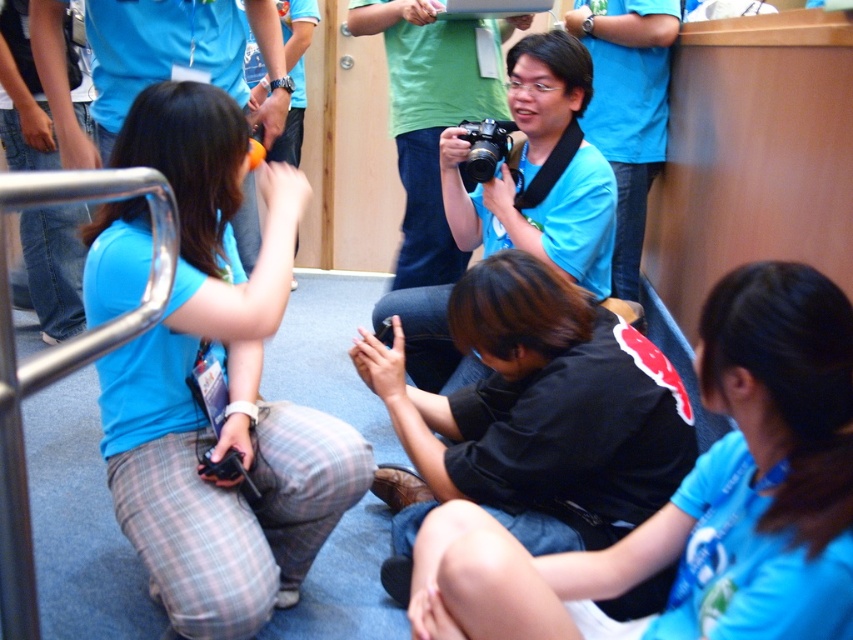
You are organizing a photo shoot and need to ensure that the matte blue shirt at left and the black plastic camera at center are both visible in the frame. Given their sizes, which object should be placed closer to the camera to maintain visibility?

The matte blue shirt at left is larger than the black plastic camera at center. To ensure both are visible, the black plastic camera at center should be placed closer to the camera so its smaller size can be captured clearly alongside the larger matte blue shirt at left.

In the scene described, there is a point located at coordinates (225, 388). Which object from the list is this point situated on?

The point at (225, 388) is situated on the matte blue shirt at left.

Looking at this image, you are standing in the room and see the point marked as point (540, 170). Is there a camera at that point?

Yes, the matte blue camera at center is represented by point (540, 170), so there is a camera at that point.